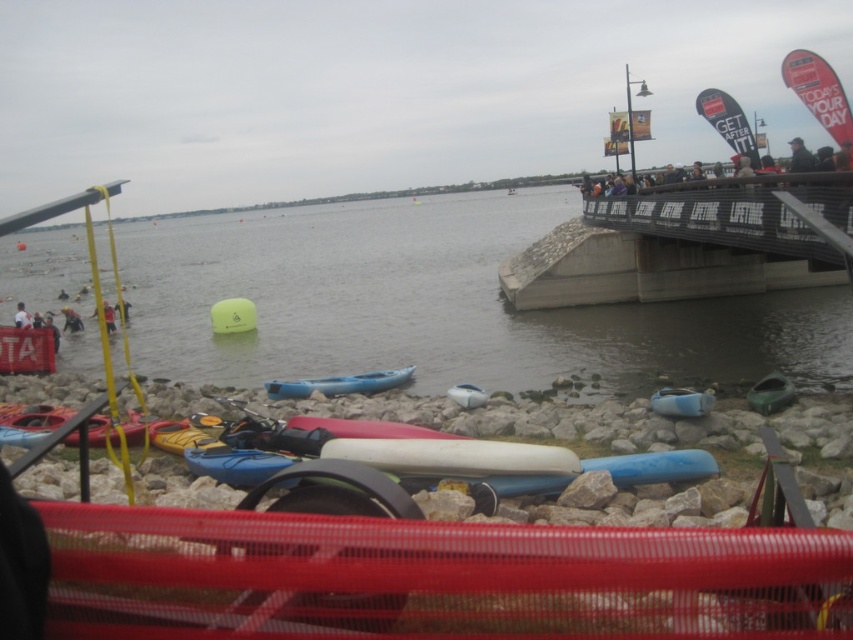
Question: Can you confirm if clear water at lower left is wider than red mesh netting at lower center?

Choices:
 (A) yes
 (B) no

Answer: (A)

Question: Among these objects, which one is nearest to the camera?

Choices:
 (A) red mesh netting at lower center
 (B) clear water at lower left
 (C) blue plastic kayak at center

Answer: (A)

Question: Which of the following is the closest to the observer?

Choices:
 (A) (463, 390)
 (B) (689, 403)

Answer: (B)

Question: Estimate the real-world distances between objects in this image. Which object is farther from the white fabric person at lower left?

Choices:
 (A) green matte kayak at lower right
 (B) blue plastic kayak at center
 (C) red mesh netting at lower center

Answer: (C)

Question: Can you confirm if blue plastic kayak at center is positioned above white matte kayak at center?

Choices:
 (A) yes
 (B) no

Answer: (A)

Question: Can you confirm if clear water at lower left is wider than red mesh netting at lower center?

Choices:
 (A) no
 (B) yes

Answer: (B)